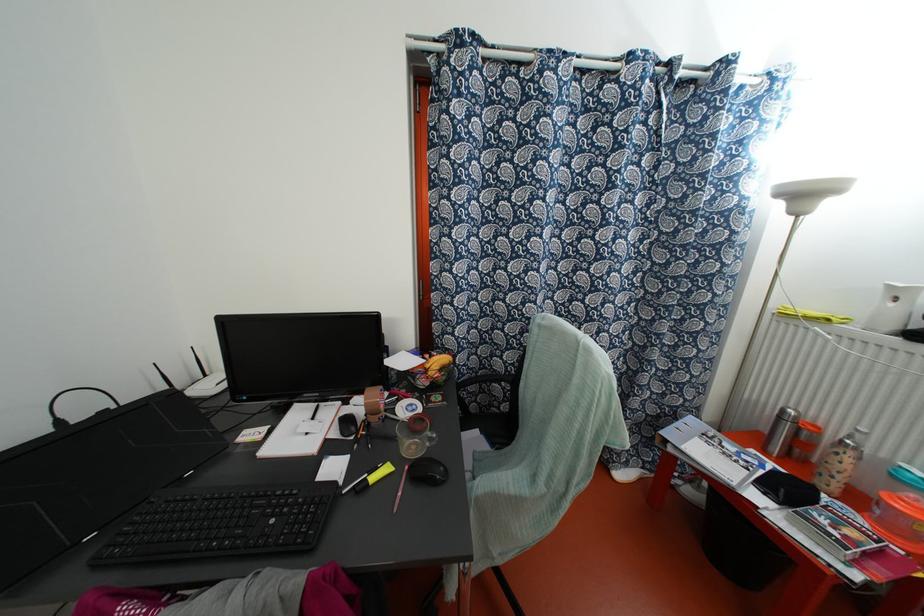
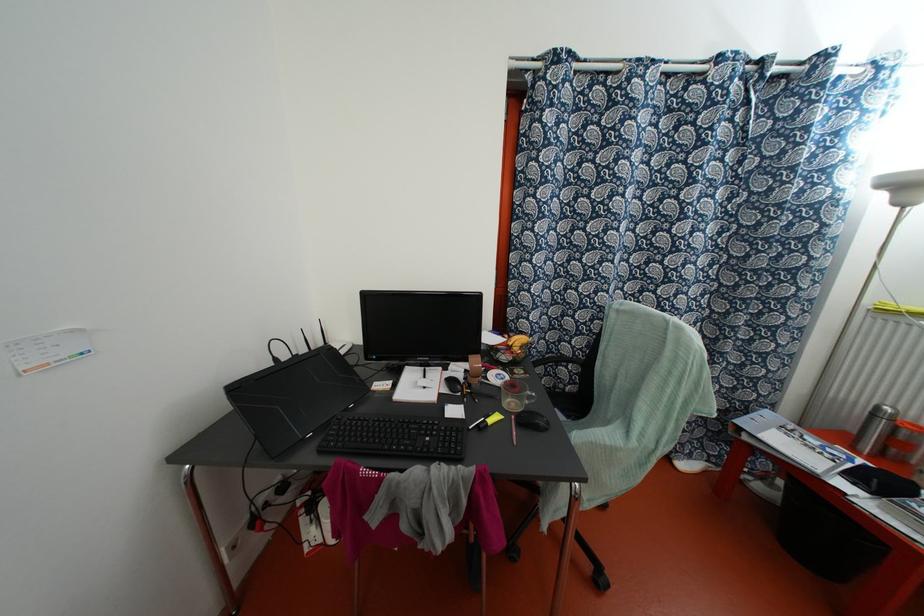
Find the pixel in the second image that matches point (421, 382) in the first image.

(504, 357)